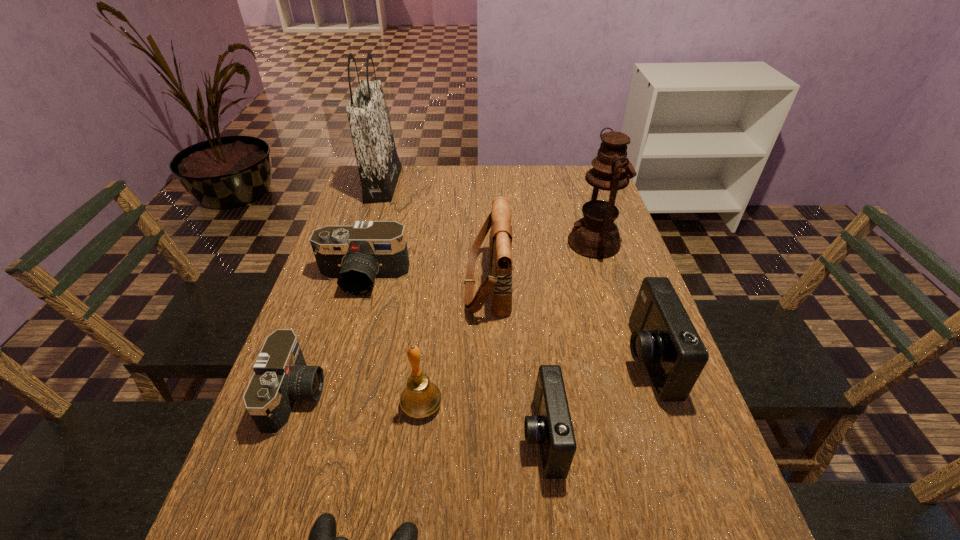
The width and height of the screenshot is (960, 540). Find the location of `vacant point located between the bigger black camera and the smaller black camera`. vacant point located between the bigger black camera and the smaller black camera is located at coordinates (330, 338).

Locate an element on the screen. The image size is (960, 540). object that is the sixth closest to the bigger blue camera is located at coordinates (356, 256).

I want to click on object that can be found as the closest to the bell, so click(551, 426).

Find the location of `camera that can be found as the closest to the smaller blue camera`. camera that can be found as the closest to the smaller blue camera is located at coordinates (663, 336).

The width and height of the screenshot is (960, 540). Identify the location of camera identified as the closest to the farthest object. (356, 256).

Image resolution: width=960 pixels, height=540 pixels. I want to click on vacant position in the image that satisfies the following two spatial constraints: 1. on the front-facing side of the nearer black camera; 2. on the left side of the bell, so [293, 405].

Locate an element on the screen. The image size is (960, 540). free space in the image that satisfies the following two spatial constraints: 1. on the front of the bell with the design; 2. on the left side of the tallest object is located at coordinates (312, 405).